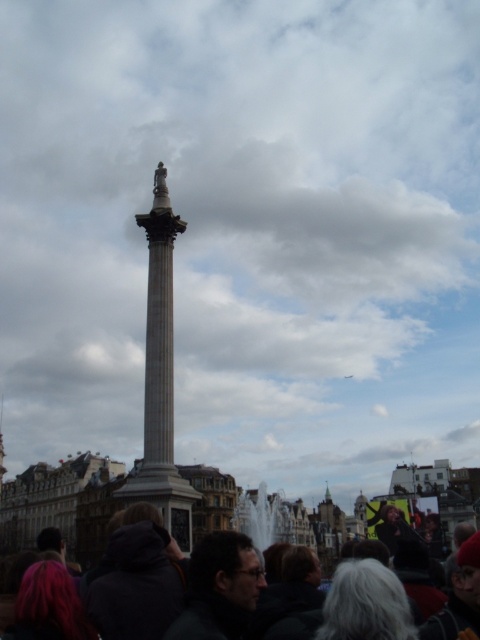
You are standing in the scene and want to find someone wearing dark gray clothing at lower center. According to the coordinates provided, where should you look relative to the column?

The dark gray clothing at lower center is located at coordinates point [182,595], which means you should look towards the lower center area relative to the column to find it.

You are standing in front of the marble column at center and want to greet a person wearing dark gray clothing at lower center. In which direction should you turn to face them?

The dark gray clothing at lower center is positioned on the right side of the marble column at center, so you should turn to your right to face them.